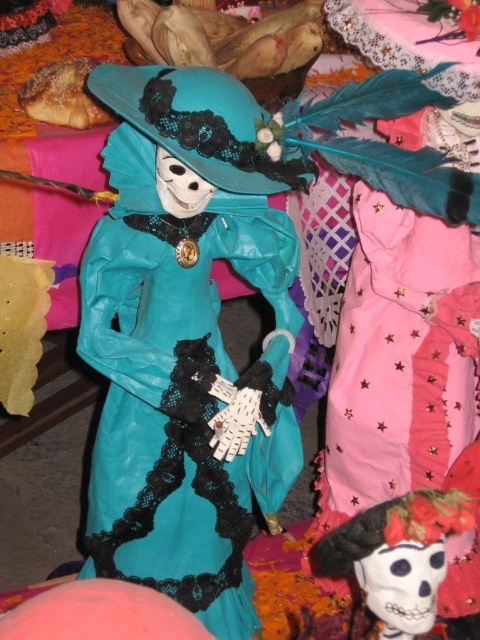
Is the position of matte teal dress at center less distant than that of matte teal fabric skull at center?

No, matte teal dress at center is further to the viewer.

Does matte teal dress at center have a larger size compared to matte teal fabric skull at center?

Yes, matte teal dress at center is bigger than matte teal fabric skull at center.

The image size is (480, 640). Describe the element at coordinates (187, 340) in the screenshot. I see `matte teal dress at center` at that location.

Where is `matte teal dress at center`? The height and width of the screenshot is (640, 480). matte teal dress at center is located at coordinates (187, 340).